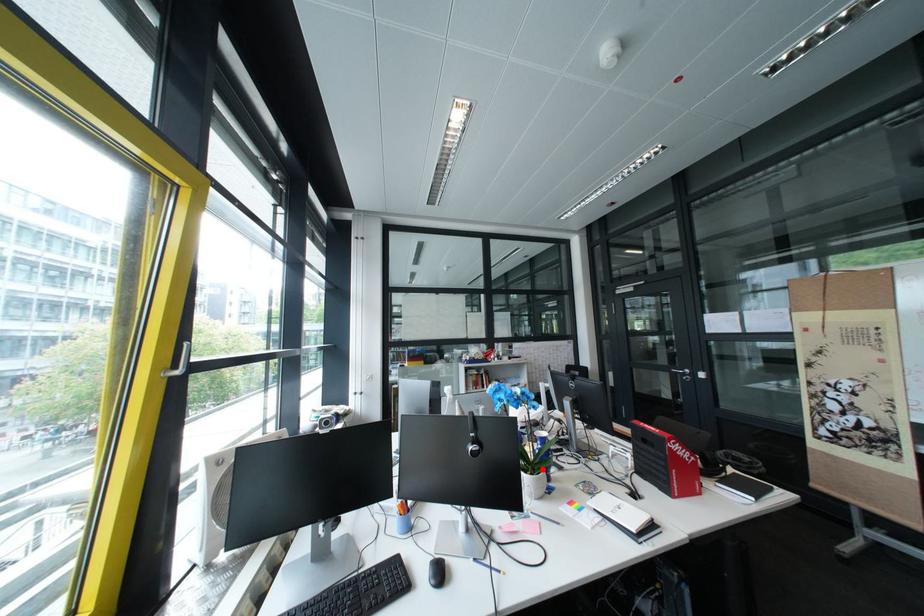
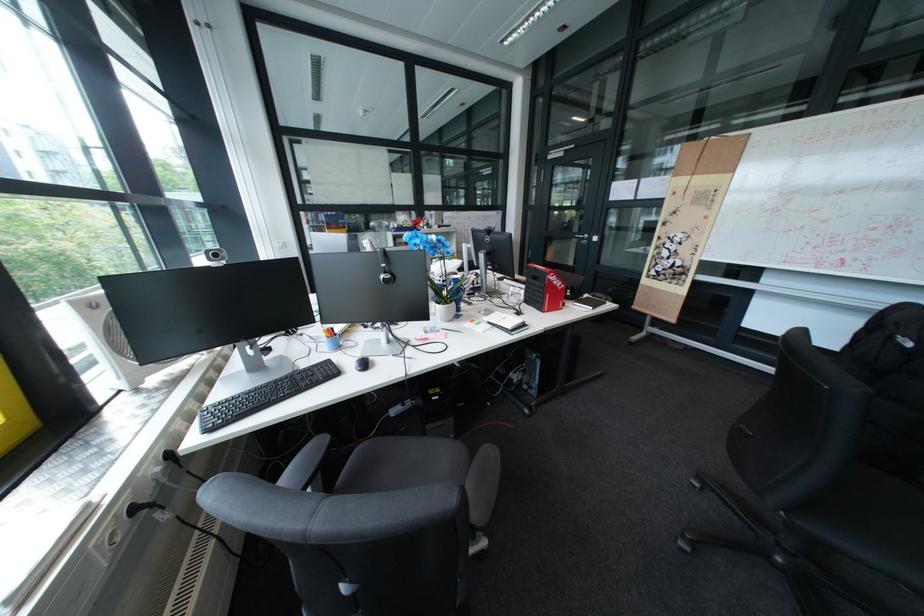
Question: I am providing you with two images of the same scene from different viewpoints. In image1, a red point is highlighted. Considering the same 3D point in image2, which of the following is correct?

Choices:
 (A) It is closer
 (B) It is farther

Answer: (B)